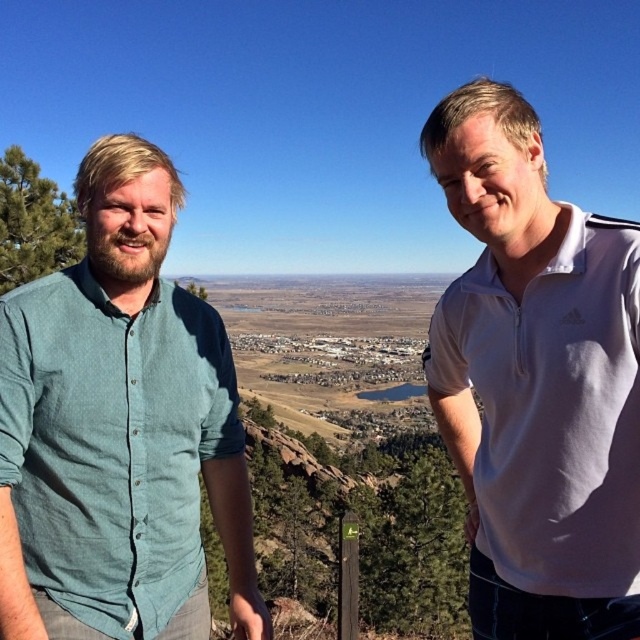
Question: Which point appears farthest from the camera in this image?

Choices:
 (A) (561, 465)
 (B) (48, 557)

Answer: (B)

Question: Is teal cotton shirt at left thinner than white cotton polo shirt at right?

Choices:
 (A) no
 (B) yes

Answer: (A)

Question: Which of the following is the farthest from the observer?

Choices:
 (A) (237, 630)
 (B) (508, 371)

Answer: (A)

Question: Is teal cotton shirt at left closer to the viewer compared to white cotton polo shirt at right?

Choices:
 (A) no
 (B) yes

Answer: (B)

Question: Is teal cotton shirt at left further to the viewer compared to white cotton polo shirt at right?

Choices:
 (A) no
 (B) yes

Answer: (A)